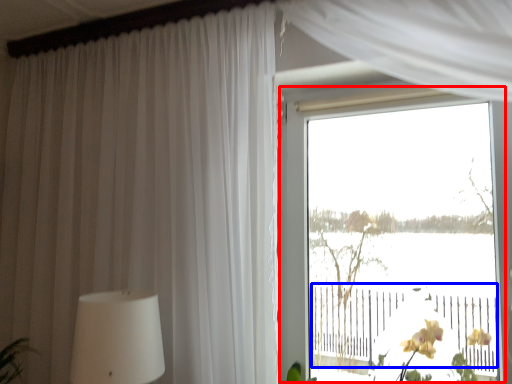
Question: Which object is further to the camera taking this photo, window (highlighted by a red box) or rail (highlighted by a blue box)?

Choices:
 (A) window
 (B) rail

Answer: (A)